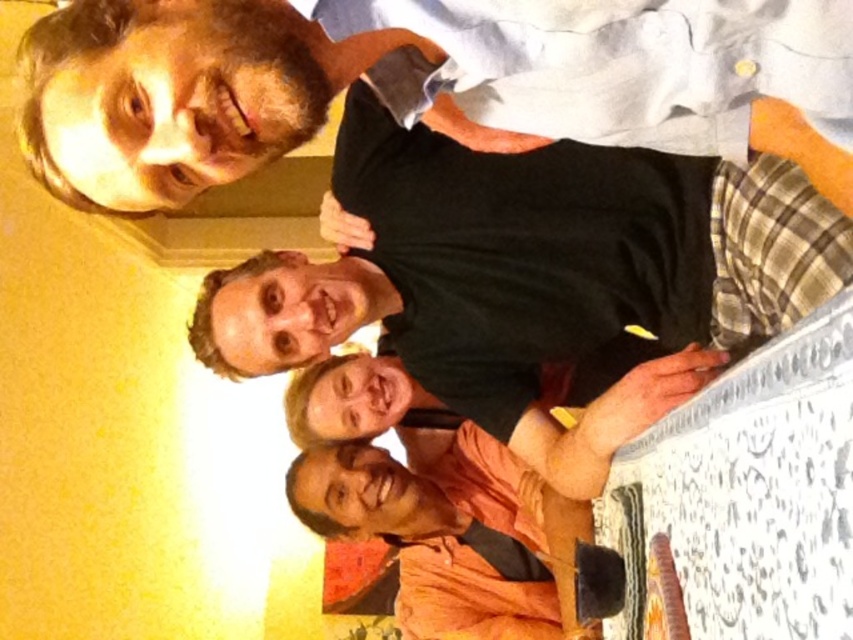
You are trying to identify the positions of two people in the photo. There is a black matte shirt at upper center and a matte black shirt at upper left. Which one is positioned more to the left?

The matte black shirt at upper left is positioned more to the left than the black matte shirt at upper center.